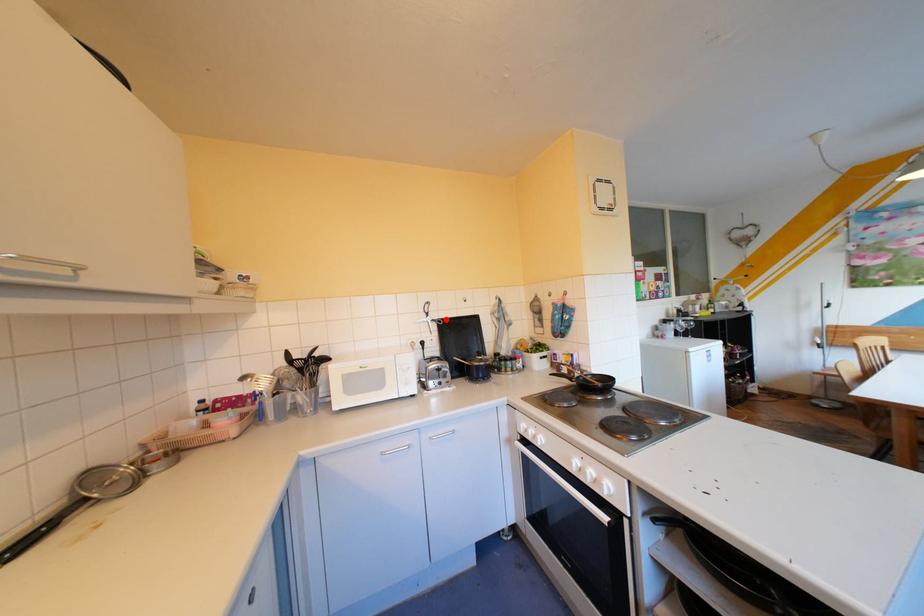
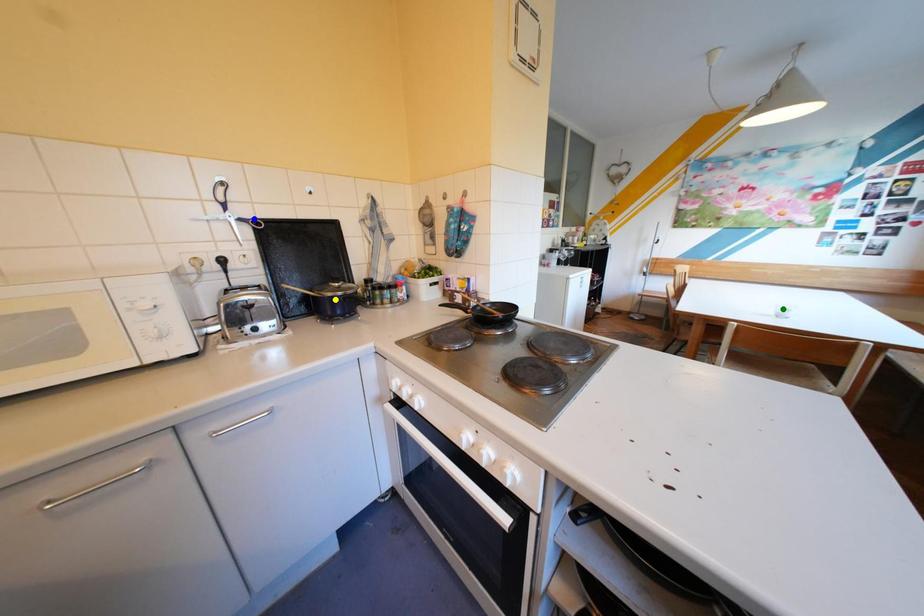
Question: I am providing you with two images of the same scene from different viewpoints. A red point is marked on the first image. You are given multiple points on the second image. In image 2, which mark is for the same physical point as the one in image 1?

Choices:
 (A) blue point
 (B) yellow point
 (C) green point

Answer: (A)